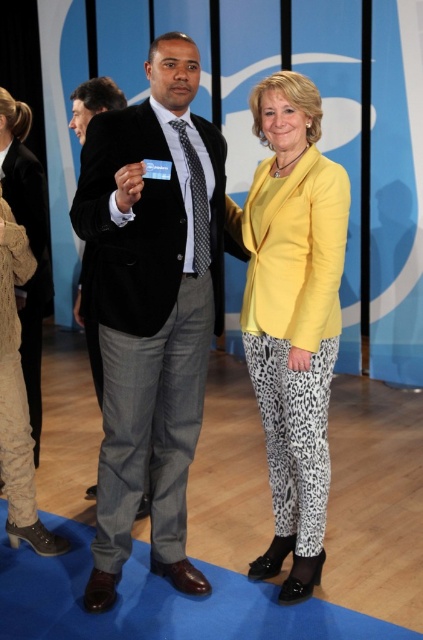
Who is shorter, yellow matte blazer at center or matte black suit at center?

With less height is matte black suit at center.

Can you confirm if yellow matte blazer at center is positioned to the left of matte black suit at center?

No, yellow matte blazer at center is not to the left of matte black suit at center.

I want to click on yellow matte blazer at center, so click(x=293, y=317).

This screenshot has width=423, height=640. Describe the element at coordinates (151, 307) in the screenshot. I see `velvet black coat at center` at that location.

Is velvet black coat at center wider than yellow matte blazer at center?

Indeed, velvet black coat at center has a greater width compared to yellow matte blazer at center.

This screenshot has width=423, height=640. In order to click on velvet black coat at center in this screenshot , I will do `click(151, 307)`.

The height and width of the screenshot is (640, 423). What are the coordinates of `velvet black coat at center` in the screenshot? It's located at (151, 307).

Can you confirm if knitted beige sweater at left is smaller than matte black suit at center?

Incorrect, knitted beige sweater at left is not smaller in size than matte black suit at center.

Is knitted beige sweater at left positioned before matte black suit at center?

No, it is behind matte black suit at center.

Is point (24, 371) positioned before point (88, 332)?

That is False.

Locate an element on the screen. Image resolution: width=423 pixels, height=640 pixels. knitted beige sweater at left is located at coordinates (35, 269).